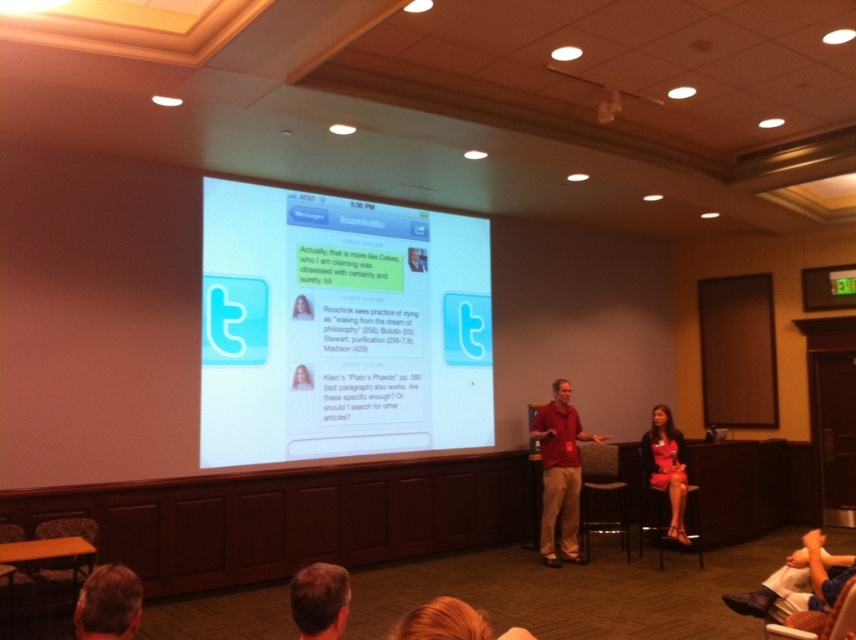
Based on the photo, you are organizing a photo shoot and need to ensure that all clothing items are visible in the final image. Given the scene described, which object among the matte red shirt at center and the light brown hair at lower center might be partially obscured due to its size?

The matte red shirt at center is bigger than the light brown hair at lower center, so the light brown hair at lower center might be partially obscured due to its smaller size compared to the shirt.